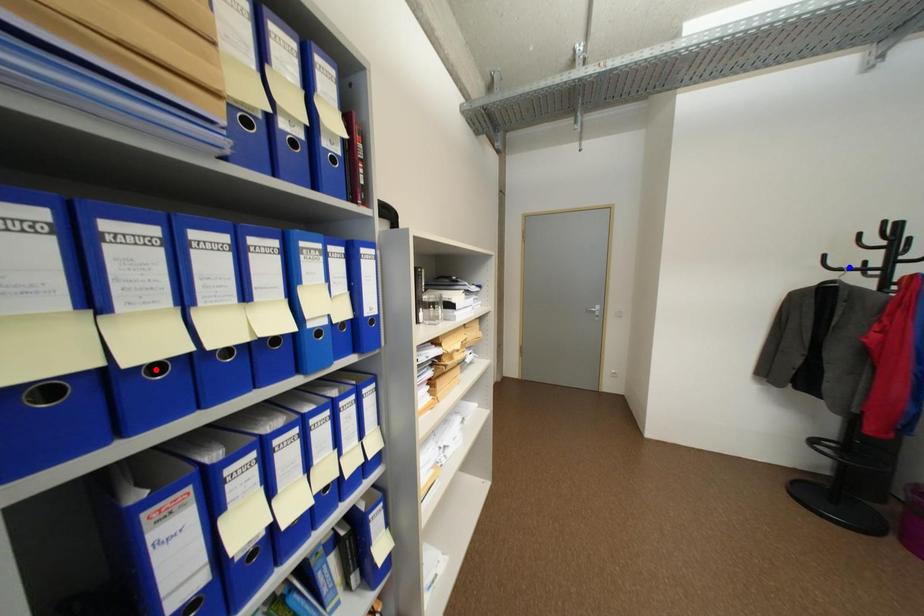
Question: Which of the two points in the image is closer to the camera?

Choices:
 (A) Blue point is closer.
 (B) Red point is closer.

Answer: (B)